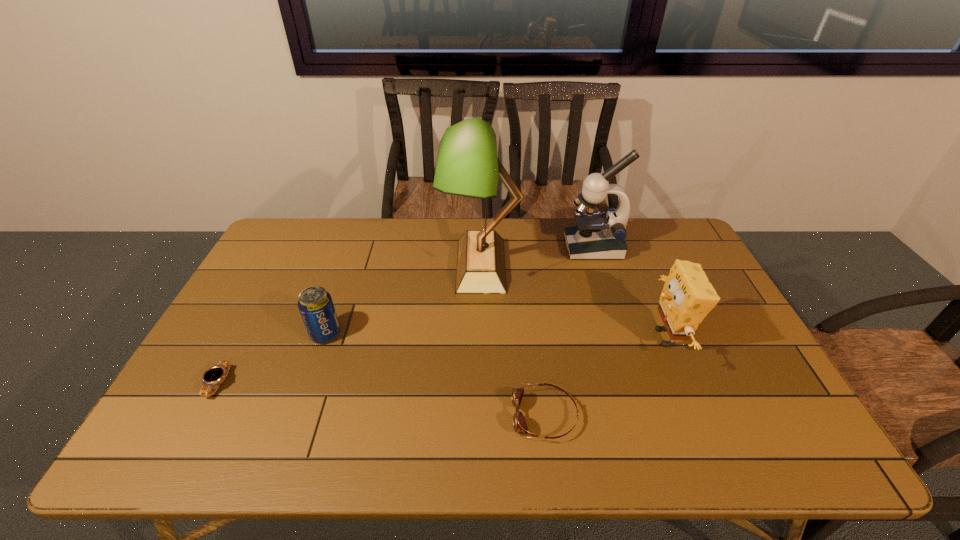
Locate an element on the screen. table lamp present at the far edge is located at coordinates (467, 165).

Identify the location of microscope at the far edge. [597, 236].

The width and height of the screenshot is (960, 540). What are the coordinates of `object at the near edge` in the screenshot? It's located at tap(519, 422).

Locate an element on the screen. This screenshot has height=540, width=960. object at the left edge is located at coordinates (215, 375).

This screenshot has width=960, height=540. In order to click on vacant space at the far edge of the desktop in this screenshot , I will do `click(509, 246)`.

Find the location of a particular element. This screenshot has width=960, height=540. vacant space at the near edge of the desktop is located at coordinates pos(489,454).

In the image, there is a desktop. At what (x,y) coordinates should I click in order to perform the action: click on blank space at the left edge. Please return your answer as a coordinate pair (x, y). This screenshot has width=960, height=540. Looking at the image, I should click on (228, 343).

In the image, there is a desktop. Where is `free space at the right edge`? free space at the right edge is located at coordinates (708, 345).

Where is `vacant space at the near right corner`? The image size is (960, 540). vacant space at the near right corner is located at coordinates (733, 434).

This screenshot has height=540, width=960. I want to click on free space between the goggles and the leftmost object, so click(382, 400).